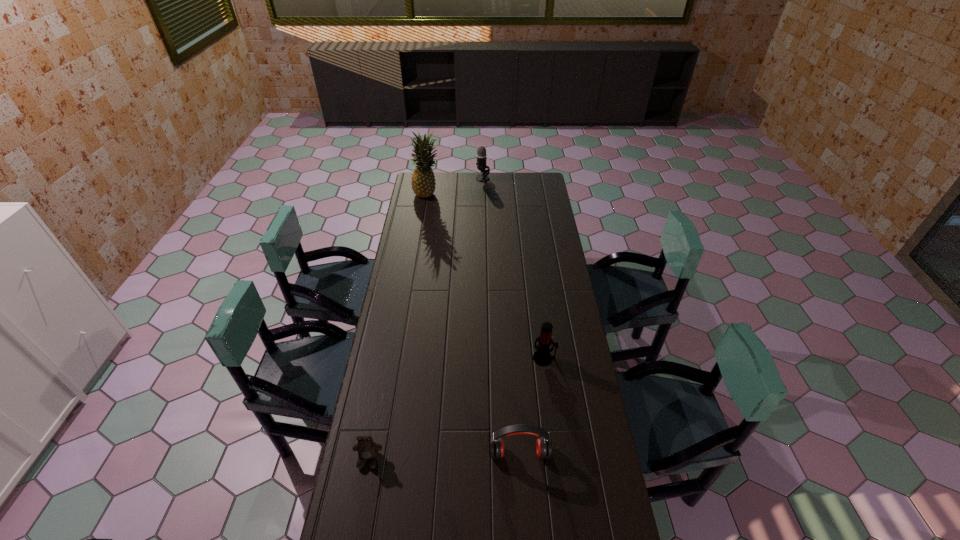
Identify the location of microphone that stands as the second closest to the tallest object. (542, 356).

You are a GUI agent. You are given a task and a screenshot of the screen. Output one action in this format:
    pyautogui.click(x=<x>, y=<y>)
    Task: Click on the second closest microphone to the pineapple
    This screenshot has height=540, width=960.
    Given the screenshot: What is the action you would take?
    pyautogui.click(x=542, y=356)